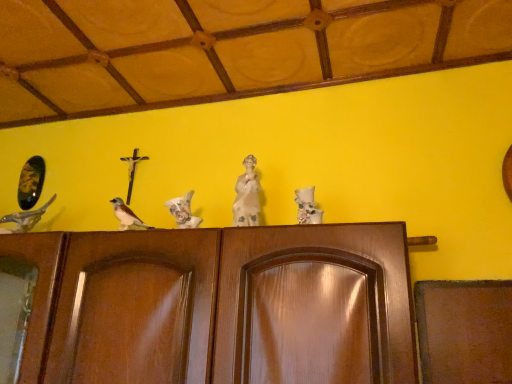
Question: From a real-world perspective, is brown matte bird at center, the second bird from the right, over white porcelain statue at center?

Choices:
 (A) yes
 (B) no

Answer: (B)

Question: Would you say brown matte bird at center, the 2th bird positioned from the left, is outside white porcelain statue at center?

Choices:
 (A) yes
 (B) no

Answer: (A)

Question: Is brown matte bird at center, the second bird from the right, to the right of white porcelain statue at center from the viewer's perspective?

Choices:
 (A) no
 (B) yes

Answer: (A)

Question: Does brown matte bird at center, the second bird from the right, come behind white porcelain statue at center?

Choices:
 (A) no
 (B) yes

Answer: (B)

Question: Is brown matte bird at center, the 2th bird positioned from the left, oriented away from white porcelain statue at center?

Choices:
 (A) no
 (B) yes

Answer: (A)

Question: From a real-world perspective, is shiny metallic bird at left, which is the first bird from left to right, above or below white porcelain statue at center?

Choices:
 (A) above
 (B) below

Answer: (B)

Question: Based on their sizes in the image, would you say shiny metallic bird at left, the third bird from the right, is bigger or smaller than white porcelain statue at center?

Choices:
 (A) big
 (B) small

Answer: (A)

Question: Considering the positions of shiny metallic bird at left, which is the first bird from left to right, and white porcelain statue at center in the image, is shiny metallic bird at left, which is the first bird from left to right, taller or shorter than white porcelain statue at center?

Choices:
 (A) short
 (B) tall

Answer: (A)

Question: Is shiny metallic bird at left, which is the first bird from left to right, inside the boundaries of white porcelain statue at center, or outside?

Choices:
 (A) inside
 (B) outside

Answer: (B)

Question: From a real-world perspective, is brown matte bird at center, the 2th bird positioned from the left, physically located above or below white porcelain statue at center?

Choices:
 (A) above
 (B) below

Answer: (B)

Question: Would you say brown matte bird at center, the 2th bird positioned from the left, is to the left or to the right of white porcelain statue at center in the picture?

Choices:
 (A) left
 (B) right

Answer: (A)

Question: From their relative heights in the image, would you say brown matte bird at center, the 2th bird positioned from the left, is taller or shorter than white porcelain statue at center?

Choices:
 (A) tall
 (B) short

Answer: (B)

Question: Looking at their shapes, would you say brown matte bird at center, the second bird from the right, is wider or thinner than white porcelain statue at center?

Choices:
 (A) wide
 (B) thin

Answer: (A)

Question: From a real-world perspective, is white matte bird at center, which ranks as the 1th bird in right-to-left order, above or below white porcelain statue at center?

Choices:
 (A) above
 (B) below

Answer: (B)

Question: Is white matte bird at center, which ranks as the 1th bird in right-to-left order, inside or outside of white porcelain statue at center?

Choices:
 (A) outside
 (B) inside

Answer: (A)